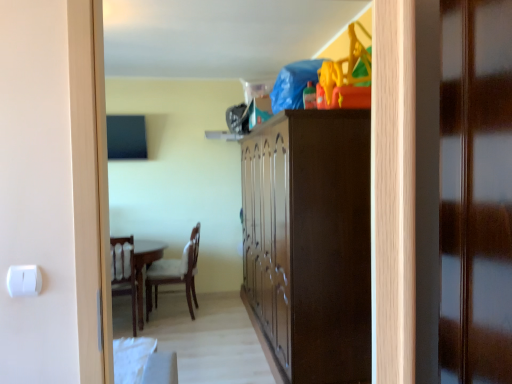
Question: Is dark wood cabinet at center not near wooden door at right?

Choices:
 (A) yes
 (B) no

Answer: (A)

Question: Is dark wood cabinet at center not inside wooden door at right?

Choices:
 (A) yes
 (B) no

Answer: (A)

Question: Considering the relative sizes of dark wood cabinet at center and wooden door at right in the image provided, is dark wood cabinet at center wider than wooden door at right?

Choices:
 (A) yes
 (B) no

Answer: (A)

Question: Does dark wood cabinet at center lie in front of wooden door at right?

Choices:
 (A) no
 (B) yes

Answer: (A)

Question: Is dark wood cabinet at center taller than wooden door at right?

Choices:
 (A) yes
 (B) no

Answer: (A)

Question: Is dark wood cabinet at center touching wooden door at right?

Choices:
 (A) no
 (B) yes

Answer: (A)

Question: Considering the relative sizes of wooden door at right and dark wood cabinet at center in the image provided, is wooden door at right shorter than dark wood cabinet at center?

Choices:
 (A) yes
 (B) no

Answer: (A)

Question: Is dark wood cabinet at center completely or partially inside wooden door at right?

Choices:
 (A) yes
 (B) no

Answer: (B)

Question: Are wooden door at right and dark wood cabinet at center beside each other?

Choices:
 (A) yes
 (B) no

Answer: (B)

Question: Is wooden door at right thinner than dark wood cabinet at center?

Choices:
 (A) no
 (B) yes

Answer: (B)

Question: Does wooden door at right have a smaller size compared to dark wood cabinet at center?

Choices:
 (A) yes
 (B) no

Answer: (A)

Question: Is wooden door at right positioned beyond the bounds of dark wood cabinet at center?

Choices:
 (A) no
 (B) yes

Answer: (B)

Question: Relative to dark wood cabinet at center, is wooden door at right in front or behind?

Choices:
 (A) behind
 (B) front

Answer: (B)